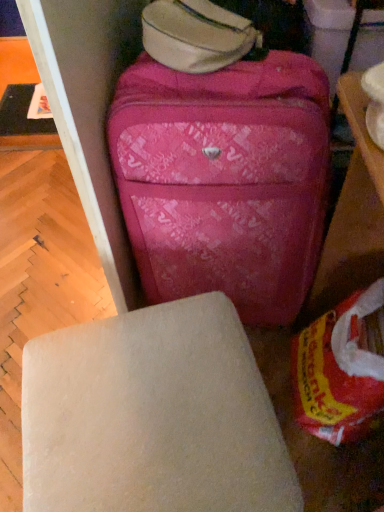
Question: Does matte white table at upper right, which is the second table from back to front, lie behind black plastic table at upper left, marked as the second table in a right-to-left arrangement?

Choices:
 (A) no
 (B) yes

Answer: (A)

Question: Is matte white table at upper right, arranged as the second table when viewed from the left, positioned with its back to black plastic table at upper left, which ranks as the 2th table in bottom-to-top order?

Choices:
 (A) yes
 (B) no

Answer: (B)

Question: Is matte white table at upper right, arranged as the second table when viewed from the left, not inside black plastic table at upper left, marked as the second table in a front-to-back arrangement?

Choices:
 (A) no
 (B) yes

Answer: (B)

Question: Can you confirm if matte white table at upper right, which is the second table from back to front, is positioned to the right of black plastic table at upper left, which is the first table in top-to-bottom order?

Choices:
 (A) no
 (B) yes

Answer: (B)

Question: Does matte white table at upper right, placed as the first table when sorted from right to left, have a larger size compared to black plastic table at upper left, the first table when ordered from left to right?

Choices:
 (A) yes
 (B) no

Answer: (A)

Question: Is black plastic table at upper left, the first table when ordered from left to right, taller or shorter than pink fabric suitcase at center?

Choices:
 (A) tall
 (B) short

Answer: (B)

Question: Is black plastic table at upper left, the first table when ordered from left to right, situated inside pink fabric suitcase at center or outside?

Choices:
 (A) outside
 (B) inside

Answer: (A)

Question: Based on their positions, is black plastic table at upper left, marked as the second table in a front-to-back arrangement, located to the left or right of pink fabric suitcase at center?

Choices:
 (A) left
 (B) right

Answer: (A)

Question: From a real-world perspective, relative to pink fabric suitcase at center, is black plastic table at upper left, marked as the second table in a front-to-back arrangement, vertically above or below?

Choices:
 (A) above
 (B) below

Answer: (B)

Question: Considering their positions, is pink fabric suitcase at center located in front of or behind white matte stool at center?

Choices:
 (A) behind
 (B) front

Answer: (A)

Question: Is pink fabric suitcase at center bigger or smaller than white matte stool at center?

Choices:
 (A) big
 (B) small

Answer: (A)

Question: Do you think pink fabric suitcase at center is within white matte stool at center, or outside of it?

Choices:
 (A) outside
 (B) inside

Answer: (A)

Question: In terms of height, does pink fabric suitcase at center look taller or shorter compared to white matte stool at center?

Choices:
 (A) tall
 (B) short

Answer: (A)

Question: From the image's perspective, is matte white table at upper right, which is the second table from back to front, located above or below pink fabric suitcase at center?

Choices:
 (A) above
 (B) below

Answer: (A)

Question: Is matte white table at upper right, marked as the second table in a top-to-bottom arrangement, in front of or behind pink fabric suitcase at center in the image?

Choices:
 (A) behind
 (B) front

Answer: (B)